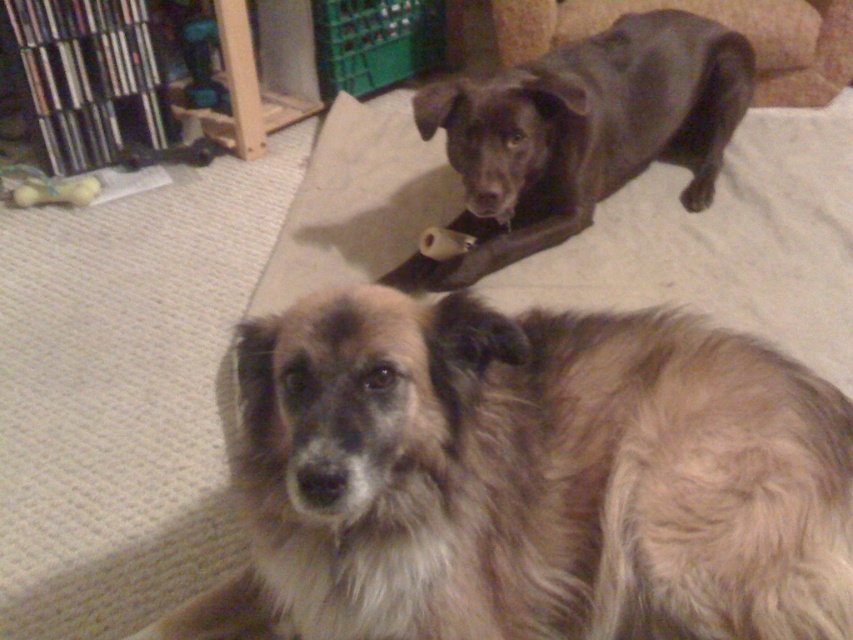
Question: Does brown shaggy dog at lower center have a lesser width compared to shiny black dog at upper center?

Choices:
 (A) yes
 (B) no

Answer: (A)

Question: Which point is closer to the camera taking this photo?

Choices:
 (A) (318, 336)
 (B) (689, 77)

Answer: (A)

Question: Considering the relative positions of brown shaggy dog at lower center and shiny black dog at upper center in the image provided, where is brown shaggy dog at lower center located with respect to shiny black dog at upper center?

Choices:
 (A) above
 (B) below

Answer: (B)

Question: Which object appears closest to the camera in this image?

Choices:
 (A) brown shaggy dog at lower center
 (B) shiny black dog at upper center

Answer: (A)

Question: Is brown shaggy dog at lower center to the left of shiny black dog at upper center from the viewer's perspective?

Choices:
 (A) yes
 (B) no

Answer: (A)